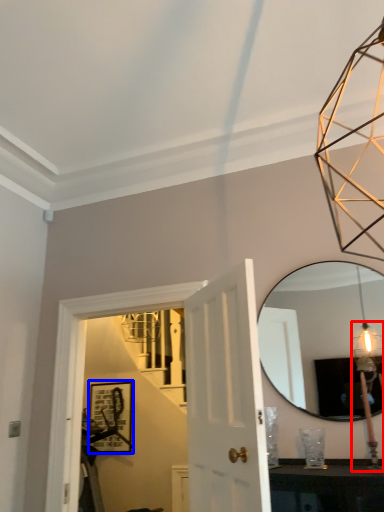
Question: Which object appears closest to the camera in this image, light fixture (highlighted by a red box) or picture frame (highlighted by a blue box)?

Choices:
 (A) light fixture
 (B) picture frame

Answer: (A)